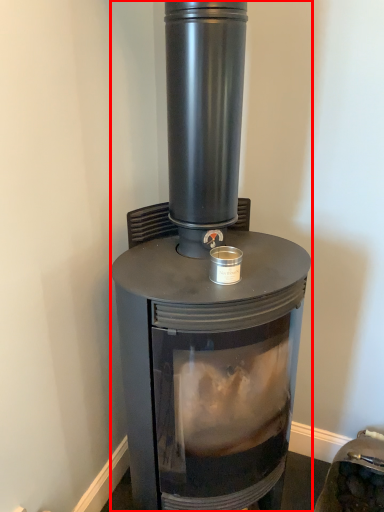
Question: From the image's perspective, where is wood burning stove (annotated by the red box) located relative to appliance?

Choices:
 (A) below
 (B) above

Answer: (B)